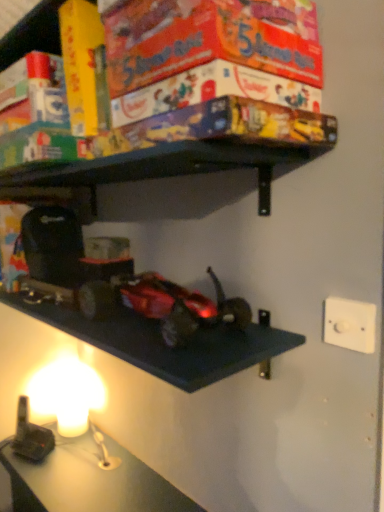
You are a GUI agent. You are given a task and a screenshot of the screen. Output one action in this format:
    pyautogui.click(x=<x>, y=<y>)
    Task: Click on the shiny metallic car at center
    This screenshot has height=512, width=384.
    Given the screenshot: What is the action you would take?
    pyautogui.click(x=163, y=304)

Image resolution: width=384 pixels, height=512 pixels. What do you see at coordinates (163, 304) in the screenshot?
I see `shiny metallic car at center` at bounding box center [163, 304].

Describe the element at coordinates (349, 324) in the screenshot. The image size is (384, 512). I see `white plastic/light switch at upper right` at that location.

Where is `white plastic/light switch at upper right`? Image resolution: width=384 pixels, height=512 pixels. white plastic/light switch at upper right is located at coordinates (349, 324).

Where is `shiny metallic car at center`? This screenshot has height=512, width=384. shiny metallic car at center is located at coordinates (163, 304).

Considering the relative positions of shiny metallic car at center and white plastic/light switch at upper right in the image provided, is shiny metallic car at center to the left of white plastic/light switch at upper right from the viewer's perspective?

Indeed, shiny metallic car at center is positioned on the left side of white plastic/light switch at upper right.

Is shiny metallic car at center in front of or behind white plastic/light switch at upper right in the image?

shiny metallic car at center is positioned closer to the viewer than white plastic/light switch at upper right.

Is point (140, 307) closer or farther from the camera than point (351, 330)?

Point (140, 307).

From the image's perspective, which is above, shiny metallic car at center or white plastic/light switch at upper right?

shiny metallic car at center, from the image's perspective.

From the picture: From a real-world perspective, which object rests below the other?

white plastic/light switch at upper right is physically lower.

Which object is thinner, shiny metallic car at center or white plastic/light switch at upper right?

white plastic/light switch at upper right.

Is shiny metallic car at center taller than white plastic/light switch at upper right?

Yes, shiny metallic car at center is taller than white plastic/light switch at upper right.

In the scene shown: Considering the sizes of objects shiny metallic car at center and white plastic/light switch at upper right in the image provided, who is bigger, shiny metallic car at center or white plastic/light switch at upper right?

shiny metallic car at center.

From the picture: Would you say shiny metallic car at center is outside white plastic/light switch at upper right?

Yes, shiny metallic car at center is not within white plastic/light switch at upper right.

Are shiny metallic car at center and white plastic/light switch at upper right located far from each other?

shiny metallic car at center is actually quite close to white plastic/light switch at upper right.

Does shiny metallic car at center turn towards white plastic/light switch at upper right?

No, shiny metallic car at center is not aimed at white plastic/light switch at upper right.

How far apart are shiny metallic car at center and white plastic/light switch at upper right?

shiny metallic car at center and white plastic/light switch at upper right are 12.85 inches apart.

Where is `light switch lying behind the shiny metallic car at center`? This screenshot has height=512, width=384. light switch lying behind the shiny metallic car at center is located at coordinates (349, 324).

Between white plastic/light switch at upper right and shiny metallic car at center, which one appears on the right side from the viewer's perspective?

white plastic/light switch at upper right is more to the right.

Which object is more forward, white plastic/light switch at upper right or shiny metallic car at center?

shiny metallic car at center is closer to the camera.

Is point (372, 323) closer or farther from the camera than point (214, 285)?

Point (372, 323) is closer to the camera than point (214, 285).

From the image's perspective, which is below, white plastic/light switch at upper right or shiny metallic car at center?

white plastic/light switch at upper right, from the image's perspective.

From a real-world perspective, is white plastic/light switch at upper right located higher than shiny metallic car at center?

No, from a real-world perspective, white plastic/light switch at upper right is not above shiny metallic car at center.

Can you confirm if white plastic/light switch at upper right is wider than shiny metallic car at center?

In fact, white plastic/light switch at upper right might be narrower than shiny metallic car at center.

Considering the relative sizes of white plastic/light switch at upper right and shiny metallic car at center in the image provided, is white plastic/light switch at upper right taller than shiny metallic car at center?

Incorrect, the height of white plastic/light switch at upper right is not larger of that of shiny metallic car at center.

Based on their sizes in the image, would you say white plastic/light switch at upper right is bigger or smaller than shiny metallic car at center?

Considering their sizes, white plastic/light switch at upper right takes up less space than shiny metallic car at center.

Which is correct: white plastic/light switch at upper right is inside shiny metallic car at center, or outside of it?

white plastic/light switch at upper right is not enclosed by shiny metallic car at center.

Would you say white plastic/light switch at upper right is a long distance from shiny metallic car at center?

No, there isn't a large distance between white plastic/light switch at upper right and shiny metallic car at center.

Is white plastic/light switch at upper right aimed at shiny metallic car at center?

No, white plastic/light switch at upper right is not oriented towards shiny metallic car at center.

How different are the orientations of white plastic/light switch at upper right and shiny metallic car at center in degrees?

0.705 degrees.

How distant is white plastic/light switch at upper right from shiny metallic car at center?

white plastic/light switch at upper right and shiny metallic car at center are 12.85 inches apart.

This screenshot has width=384, height=512. Find the location of `toy above the white plastic/light switch at upper right (from the image's perspective)`. toy above the white plastic/light switch at upper right (from the image's perspective) is located at coordinates (163, 304).

Where is `light switch that is on the right side of shiny metallic car at center`? The height and width of the screenshot is (512, 384). light switch that is on the right side of shiny metallic car at center is located at coordinates (349, 324).

At what (x,y) coordinates should I click in order to perform the action: click on toy located in front of the white plastic/light switch at upper right. Please return your answer as a coordinate pair (x, y). The height and width of the screenshot is (512, 384). Looking at the image, I should click on (163, 304).